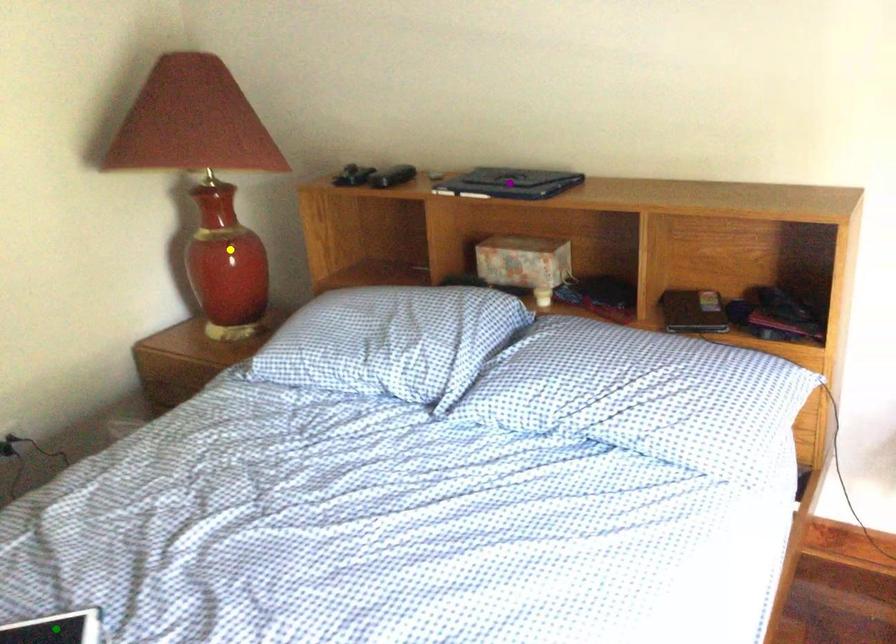
Order these from nearest to farthest:
1. green point
2. purple point
3. yellow point

green point → purple point → yellow point